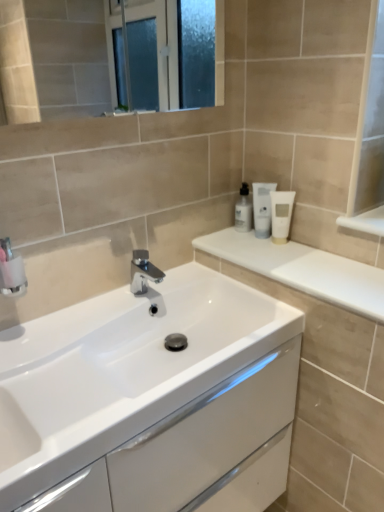
This screenshot has width=384, height=512. Describe the element at coordinates (281, 214) in the screenshot. I see `white matte tube at upper right, which is the 3th toiletry in left-to-right order` at that location.

Measure the distance between point (251, 217) and camera.

Point (251, 217) and camera are 1.40 meters apart.

Locate an element on the screen. Image resolution: width=384 pixels, height=512 pixels. chrome metallic faucet at center is located at coordinates (143, 272).

Which object is positioned more to the right, white glossy countertop at upper right or chrome metallic faucet at center?

white glossy countertop at upper right is more to the right.

From a real-world perspective, who is located lower, white glossy countertop at upper right or chrome metallic faucet at center?

chrome metallic faucet at center.

Which is in front, point (280, 258) or point (141, 265)?

Point (280, 258)

Is white matte tube at upper right, which is the second toiletry in left-to-right order, bigger than chrome metallic faucet at center?

Actually, white matte tube at upper right, which is the second toiletry in left-to-right order, might be smaller than chrome metallic faucet at center.

From a real-world perspective, which toiletry is the 3rd one above the chrome metallic faucet at center? Please provide its 2D coordinates.

[(262, 208)]

Can you tell me how much white matte tube at upper right, which is the 2th toiletry from right to left, and chrome metallic faucet at center differ in facing direction?

The facing directions of white matte tube at upper right, which is the 2th toiletry from right to left, and chrome metallic faucet at center are 43.6 degrees apart.

How distant is white matte tube at upper right, which is the 2th toiletry from right to left, from chrome metallic faucet at center?

They are 15.24 inches apart.

Is white matte tube at upper right, which is the 1th toiletry in right-to-left order, completely or partially outside of chrome metallic faucet at center?

white matte tube at upper right, which is the 1th toiletry in right-to-left order, is positioned outside chrome metallic faucet at center.

Which of these two, white matte tube at upper right, which is the 3th toiletry in left-to-right order, or chrome metallic faucet at center, stands taller?

white matte tube at upper right, which is the 3th toiletry in left-to-right order, is taller.

Does white matte tube at upper right, which is the 3th toiletry in left-to-right order, have a larger size compared to chrome metallic faucet at center?

Actually, white matte tube at upper right, which is the 3th toiletry in left-to-right order, might be smaller than chrome metallic faucet at center.

Considering the positions of objects white matte tube at upper right, which is the 3th toiletry in left-to-right order, and chrome metallic faucet at center in the image provided, who is behind, white matte tube at upper right, which is the 3th toiletry in left-to-right order, or chrome metallic faucet at center?

white matte tube at upper right, which is the 3th toiletry in left-to-right order, is further away from the camera.

From a real-world perspective, between white matte tube at upper right, which is the 2th toiletry from right to left, and white glossy cabinet at center, who is vertically higher?

white matte tube at upper right, which is the 2th toiletry from right to left, is physically above.

Can you tell me how much white matte tube at upper right, which is the second toiletry in left-to-right order, and white glossy cabinet at center differ in facing direction?

They differ by 40.7 degrees in their facing directions.

From the image's perspective, which is below, white matte tube at upper right, which is the second toiletry in left-to-right order, or white glossy cabinet at center?

white glossy cabinet at center, from the image's perspective.

I want to click on counter top that appears above the white glossy cabinet at center (from a real-world perspective), so click(303, 270).

Is white glossy cabinet at center further to camera compared to white glossy countertop at upper right?

No, the depth of white glossy cabinet at center is less than that of white glossy countertop at upper right.

Looking at this image, is white glossy cabinet at center far away from white glossy countertop at upper right?

No, white glossy cabinet at center is not far from white glossy countertop at upper right.

Which object is positioned more to the right, white matte tube at upper right, which is the second toiletry in left-to-right order, or white glossy countertop at upper right?

Positioned to the right is white glossy countertop at upper right.

Is white glossy countertop at upper right surrounded by white matte tube at upper right, which is the second toiletry in left-to-right order?

Actually, white glossy countertop at upper right is outside white matte tube at upper right, which is the second toiletry in left-to-right order.

Which is closer, [257,215] or [302,248]?

Point [257,215] is farther from the camera than point [302,248].

From a real-world perspective, which object rests below the other?

white glossy countertop at upper right is physically lower.

Looking at the image, does white matte tube at upper right, which is the 3th toiletry in left-to-right order, seem bigger or smaller compared to white glossy lotion at upper right, arranged as the first toiletry when viewed from the left?

Considering their sizes, white matte tube at upper right, which is the 3th toiletry in left-to-right order, takes up less space than white glossy lotion at upper right, arranged as the first toiletry when viewed from the left.

Which is behind, white matte tube at upper right, which is the 3th toiletry in left-to-right order, or white glossy lotion at upper right, the 3th toiletry in the right-to-left sequence?

Positioned behind is white glossy lotion at upper right, the 3th toiletry in the right-to-left sequence.

Based on the photo, is white glossy lotion at upper right, arranged as the first toiletry when viewed from the left, at the back of white matte tube at upper right, which is the 3th toiletry in left-to-right order?

No.

Considering the relative sizes of white matte tube at upper right, which is the 1th toiletry in right-to-left order, and white glossy lotion at upper right, arranged as the first toiletry when viewed from the left, in the image provided, is white matte tube at upper right, which is the 1th toiletry in right-to-left order, thinner than white glossy lotion at upper right, arranged as the first toiletry when viewed from the left,?

Indeed, white matte tube at upper right, which is the 1th toiletry in right-to-left order, has a lesser width compared to white glossy lotion at upper right, arranged as the first toiletry when viewed from the left.

At what (x,y) coordinates should I click in order to perform the action: click on tap below the white glossy countertop at upper right (from the image's perspective). Please return your answer as a coordinate pair (x, y). Image resolution: width=384 pixels, height=512 pixels. Looking at the image, I should click on (143, 272).

From the chrome metallic faucet at center, count 2nd toiletrys backward and point to it. Please provide its 2D coordinates.

[(262, 208)]

When comparing their distances from chrome metallic faucet at center, does white glossy countertop at upper right or white glossy lotion at upper right, the 3th toiletry in the right-to-left sequence, seem closer?

The object closer to chrome metallic faucet at center is white glossy lotion at upper right, the 3th toiletry in the right-to-left sequence.

Considering their positions, is white glossy countertop at upper right positioned closer to white glossy cabinet at center than chrome metallic faucet at center?

Among the two, white glossy countertop at upper right is located nearer to white glossy cabinet at center.

Looking at the image, which one is located further to white glossy cabinet at center, white glossy lotion at upper right, arranged as the first toiletry when viewed from the left, or white matte tube at upper right, which is the 3th toiletry in left-to-right order?

white glossy lotion at upper right, arranged as the first toiletry when viewed from the left, is positioned further to the anchor white glossy cabinet at center.

Looking at the image, which one is located closer to chrome metallic faucet at center, white glossy countertop at upper right or white glossy cabinet at center?

white glossy countertop at upper right.

From the image, which object appears to be farther from white glossy cabinet at center, white glossy lotion at upper right, arranged as the first toiletry when viewed from the left, or white matte tube at upper right, which is the second toiletry in left-to-right order?

white glossy lotion at upper right, arranged as the first toiletry when viewed from the left.

From the image, which object appears to be nearer to white matte tube at upper right, which is the 2th toiletry from right to left, white glossy countertop at upper right or white matte tube at upper right, which is the 1th toiletry in right-to-left order?

Answer: white matte tube at upper right, which is the 1th toiletry in right-to-left order, is positioned closer to the anchor white matte tube at upper right, which is the 2th toiletry from right to left.

Considering their positions, is white matte tube at upper right, which is the 2th toiletry from right to left, positioned further to white glossy countertop at upper right than white matte tube at upper right, which is the 1th toiletry in right-to-left order?

white matte tube at upper right, which is the 2th toiletry from right to left, lies further to white glossy countertop at upper right than the other object.

Looking at the image, which one is located closer to white glossy countertop at upper right, white glossy cabinet at center or white matte tube at upper right, which is the 3th toiletry in left-to-right order?

white matte tube at upper right, which is the 3th toiletry in left-to-right order.

Locate an element on the screen. toiletry located between chrome metallic faucet at center and white matte tube at upper right, which is the second toiletry in left-to-right order, in the left-right direction is located at coordinates (243, 210).

Find the location of `tap between white glossy countertop at upper right and white glossy lotion at upper right, arranged as the first toiletry when viewed from the left, from front to back`. tap between white glossy countertop at upper right and white glossy lotion at upper right, arranged as the first toiletry when viewed from the left, from front to back is located at coordinates (143, 272).

Where is `counter top between white glossy cabinet at center and white glossy lotion at upper right, the 3th toiletry in the right-to-left sequence, along the z-axis`? counter top between white glossy cabinet at center and white glossy lotion at upper right, the 3th toiletry in the right-to-left sequence, along the z-axis is located at coordinates (303, 270).

Identify the location of tap that lies between white matte tube at upper right, which is the 1th toiletry in right-to-left order, and white glossy cabinet at center from top to bottom. (143, 272).